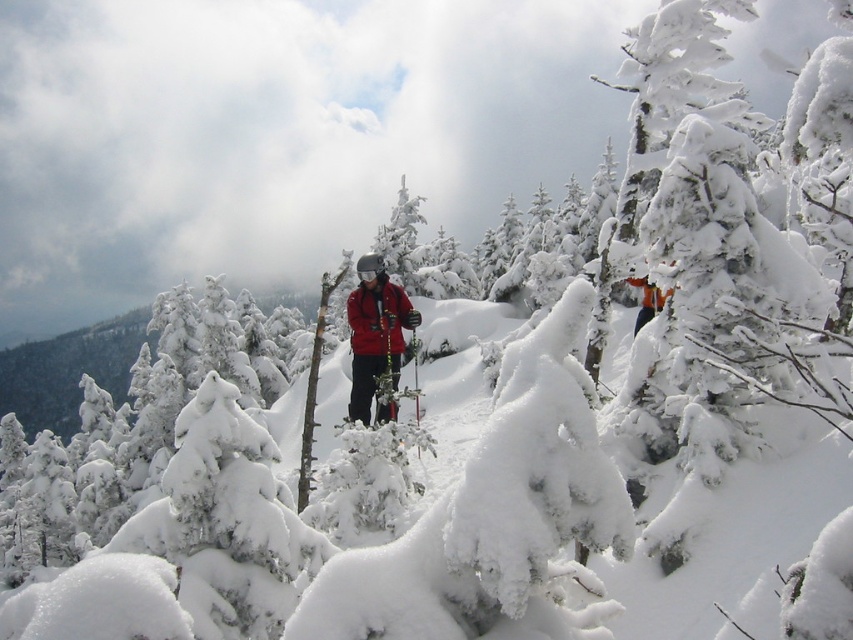
You are a photographer positioned at the edge of a snowy forest. You want to capture a clear photo of the matte red jacket at center without any trees blocking the view. Given that the trees are densely packed, can you estimate if you can take the photo from your current position?

The matte red jacket at center is 10.10 meters away from the viewer. Since the trees are densely packed but the jacket is at the center, it might be possible to take the photo if there is a clear line of sight between you and the jacket. However, the dense trees could potentially block the view depending on their arrangement.

You are a hiker lost in a snowy forest and see the scene described. There is a point marked at coordinates (375, 332). What object does this point correspond to?

The point at coordinates (375, 332) corresponds to the matte red jacket at center.

You are a photographer aiming to capture both the matte red jacket at center and the orange ski jacket at center in a single frame. Given that your camera has a fixed focal length, which jacket should you position closer to the lens to ensure both are fully visible without cropping?

Since the matte red jacket at center is wider than the orange ski jacket at center, you should position the matte red jacket at center closer to the lens to ensure both jackets are fully visible in the frame.